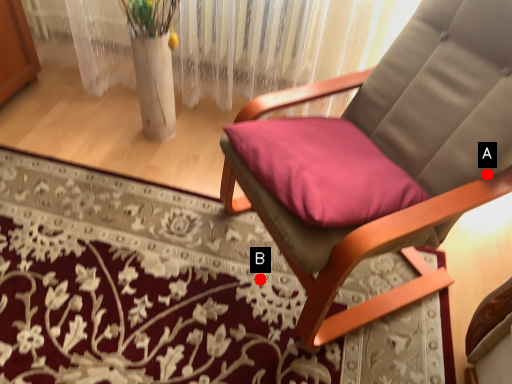
Question: Two points are circled on the image, labeled by A and B beside each circle. Which point appears closest to the camera in this image?

Choices:
 (A) A is closer
 (B) B is closer

Answer: (A)